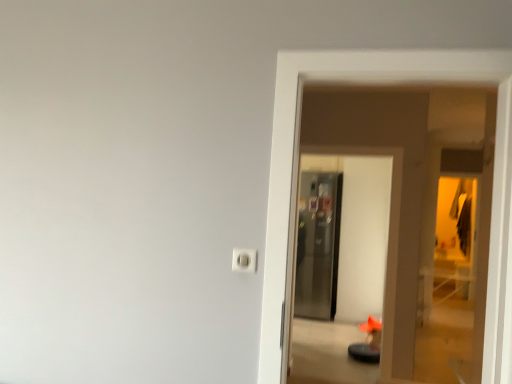
Question: Does satin metallic refrigerator at center, which is counted as the second screen door, starting from the back, appear on the right side of metallic glass screen door at center, which appears as the second screen door when viewed from the front?

Choices:
 (A) no
 (B) yes

Answer: (A)

Question: From a real-world perspective, is satin metallic refrigerator at center, placed as the 1th screen door when sorted from front to back, positioned over metallic glass screen door at center, which appears as the second screen door when viewed from the front, based on gravity?

Choices:
 (A) no
 (B) yes

Answer: (B)

Question: Is satin metallic refrigerator at center, placed as the 1th screen door when sorted from front to back, not near metallic glass screen door at center, arranged as the first screen door when viewed from the back?

Choices:
 (A) no
 (B) yes

Answer: (A)

Question: Is satin metallic refrigerator at center, placed as the 1th screen door when sorted from front to back, not inside metallic glass screen door at center, which appears as the second screen door when viewed from the front?

Choices:
 (A) yes
 (B) no

Answer: (A)

Question: From the image's perspective, would you say satin metallic refrigerator at center, which is counted as the second screen door, starting from the back, is shown under metallic glass screen door at center, arranged as the first screen door when viewed from the back?

Choices:
 (A) no
 (B) yes

Answer: (A)

Question: Is satin metallic refrigerator at center, placed as the 1th screen door when sorted from front to back, taller or shorter than white plastic outlet at center?

Choices:
 (A) short
 (B) tall

Answer: (B)

Question: Is point (321, 349) positioned closer to the camera than point (241, 259)?

Choices:
 (A) closer
 (B) farther

Answer: (B)

Question: From the image's perspective, is satin metallic refrigerator at center, which is counted as the second screen door, starting from the back, positioned above or below white plastic outlet at center?

Choices:
 (A) below
 (B) above

Answer: (A)

Question: Looking at their shapes, would you say satin metallic refrigerator at center, placed as the 1th screen door when sorted from front to back, is wider or thinner than white plastic outlet at center?

Choices:
 (A) thin
 (B) wide

Answer: (B)

Question: Considering the positions of satin metallic refrigerator at center, which is counted as the second screen door, starting from the back, and metallic glass screen door at center, arranged as the first screen door when viewed from the back, in the image, is satin metallic refrigerator at center, which is counted as the second screen door, starting from the back, bigger or smaller than metallic glass screen door at center, arranged as the first screen door when viewed from the back,?

Choices:
 (A) big
 (B) small

Answer: (A)

Question: Looking at their shapes, would you say satin metallic refrigerator at center, which is counted as the second screen door, starting from the back, is wider or thinner than metallic glass screen door at center, arranged as the first screen door when viewed from the back?

Choices:
 (A) wide
 (B) thin

Answer: (B)

Question: From the image's perspective, is satin metallic refrigerator at center, placed as the 1th screen door when sorted from front to back, located above or below metallic glass screen door at center, arranged as the first screen door when viewed from the back?

Choices:
 (A) below
 (B) above

Answer: (B)

Question: Is satin metallic refrigerator at center, placed as the 1th screen door when sorted from front to back, inside the boundaries of metallic glass screen door at center, which appears as the second screen door when viewed from the front, or outside?

Choices:
 (A) inside
 (B) outside

Answer: (B)

Question: In terms of height, does white plastic outlet at center look taller or shorter compared to satin metallic refrigerator at center, placed as the 1th screen door when sorted from front to back?

Choices:
 (A) short
 (B) tall

Answer: (A)

Question: Considering the positions of white plastic outlet at center and satin metallic refrigerator at center, placed as the 1th screen door when sorted from front to back, in the image, is white plastic outlet at center wider or thinner than satin metallic refrigerator at center, placed as the 1th screen door when sorted from front to back,?

Choices:
 (A) thin
 (B) wide

Answer: (A)